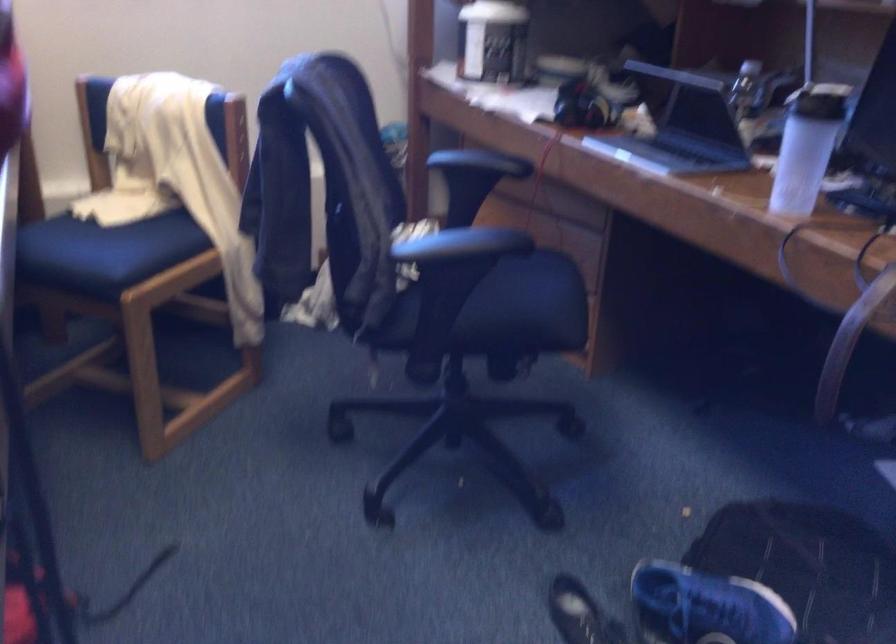
The location [709,605] corresponds to which object?

It refers to a blue shoe.